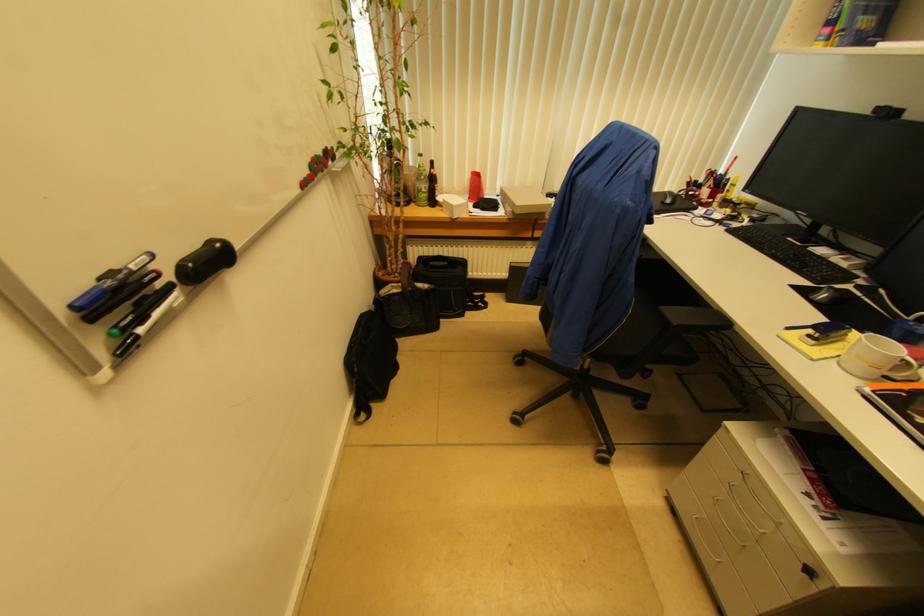
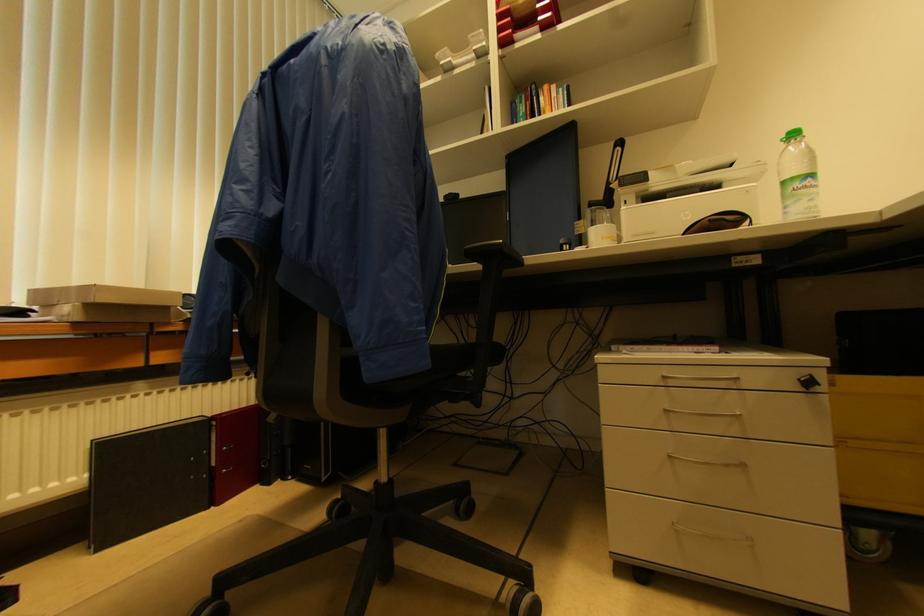
Based on the continuous images, in which direction is the camera rotating?

The camera's rotation is toward right-up.